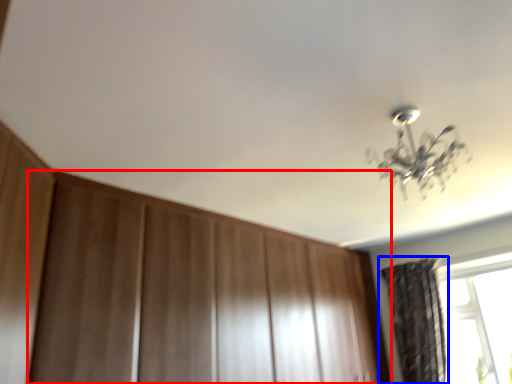
Question: Which of the following is the closest to the observer, dresser (highlighted by a red box) or curtain (highlighted by a blue box)?

Choices:
 (A) dresser
 (B) curtain

Answer: (A)